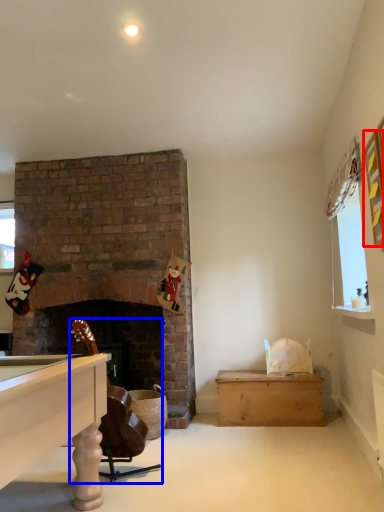
Question: Which point is further to the camera, picture frame (highlighted by a red box) or rocking chair (highlighted by a blue box)?

Choices:
 (A) picture frame
 (B) rocking chair

Answer: (B)